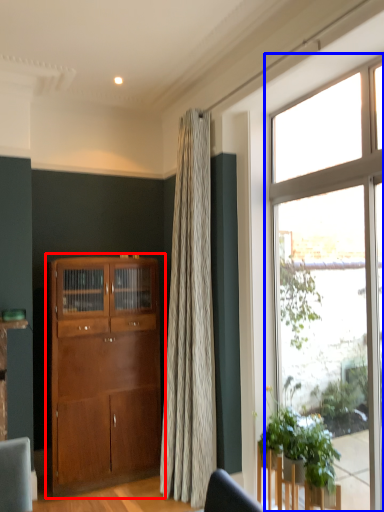
Question: Which of the following is the farthest to the observer, cabinetry (highlighted by a red box) or window (highlighted by a blue box)?

Choices:
 (A) cabinetry
 (B) window

Answer: (A)